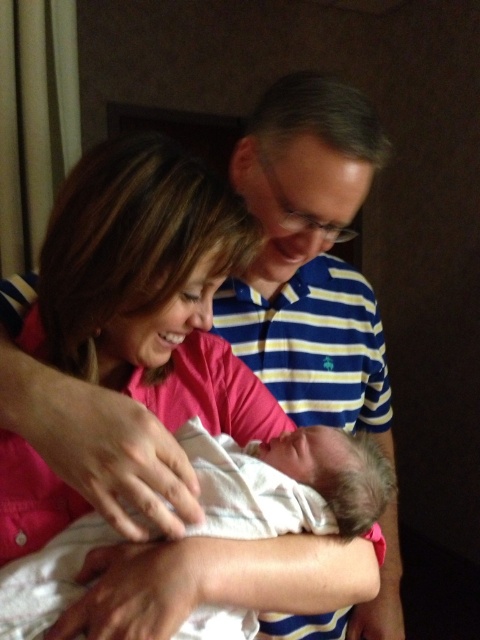
Question: Is blue striped shirt at upper center closer to the viewer compared to white soft cloth at center?

Choices:
 (A) yes
 (B) no

Answer: (B)

Question: Is blue striped shirt at upper center further to the viewer compared to white soft cloth at center?

Choices:
 (A) no
 (B) yes

Answer: (B)

Question: Which point is closer to the camera?

Choices:
 (A) (279, 502)
 (B) (239, 164)

Answer: (A)

Question: Which of the following is the closest to the observer?

Choices:
 (A) white soft cloth at center
 (B) blue striped shirt at upper center

Answer: (A)

Question: Is blue striped shirt at upper center above white soft cloth at center?

Choices:
 (A) yes
 (B) no

Answer: (A)